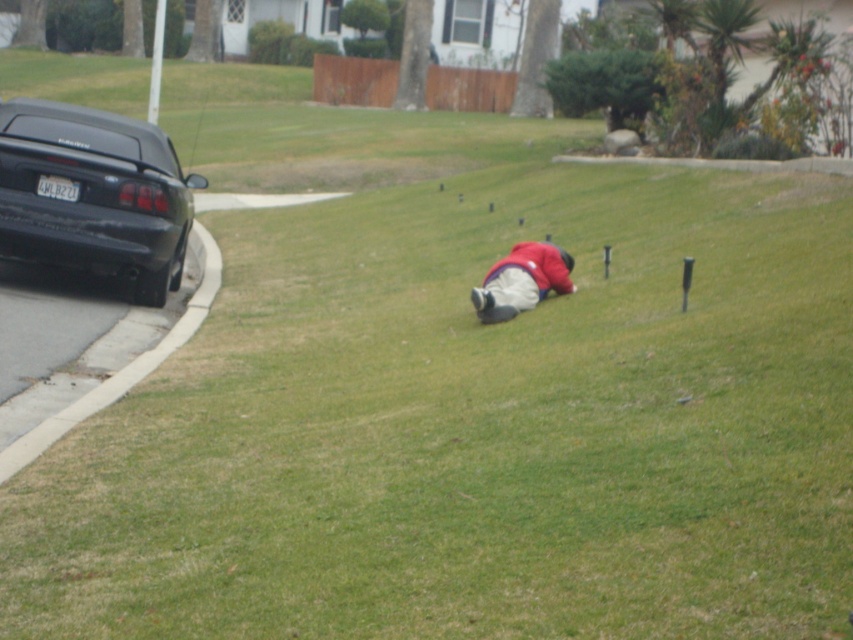
Question: Which point is farther from the camera taking this photo?

Choices:
 (A) (502, 310)
 (B) (73, 106)

Answer: (B)

Question: Where is black matte car at left located in relation to red matte jacket at center in the image?

Choices:
 (A) below
 (B) above

Answer: (B)

Question: Which of the following is the farthest from the observer?

Choices:
 (A) black matte car at left
 (B) red matte jacket at center

Answer: (A)

Question: Is black matte car at left above red matte jacket at center?

Choices:
 (A) yes
 (B) no

Answer: (A)

Question: Can you confirm if black matte car at left is smaller than red matte jacket at center?

Choices:
 (A) yes
 (B) no

Answer: (B)